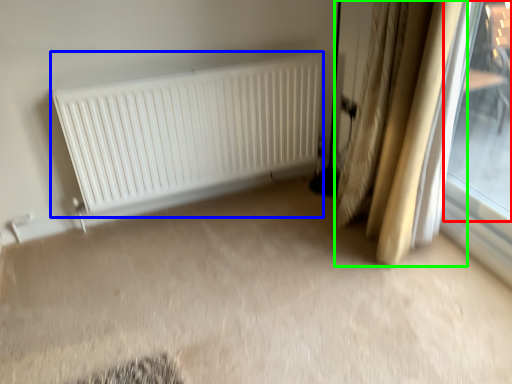
Question: Which object is the closest to the window (highlighted by a red box)? Choose among these: radiator (highlighted by a blue box) or curtain (highlighted by a green box).

Choices:
 (A) radiator
 (B) curtain

Answer: (B)